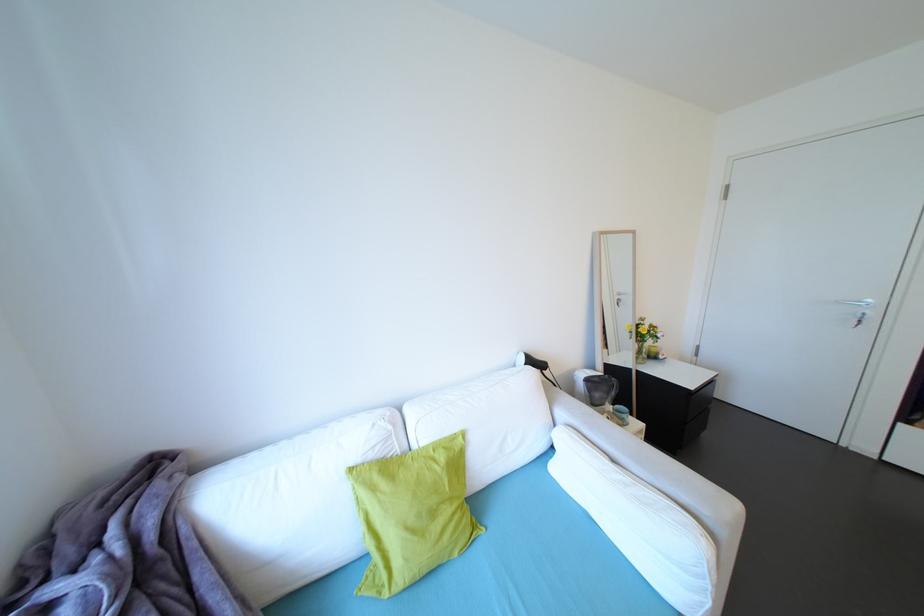
Identify the location of silver door handle. (859, 310).